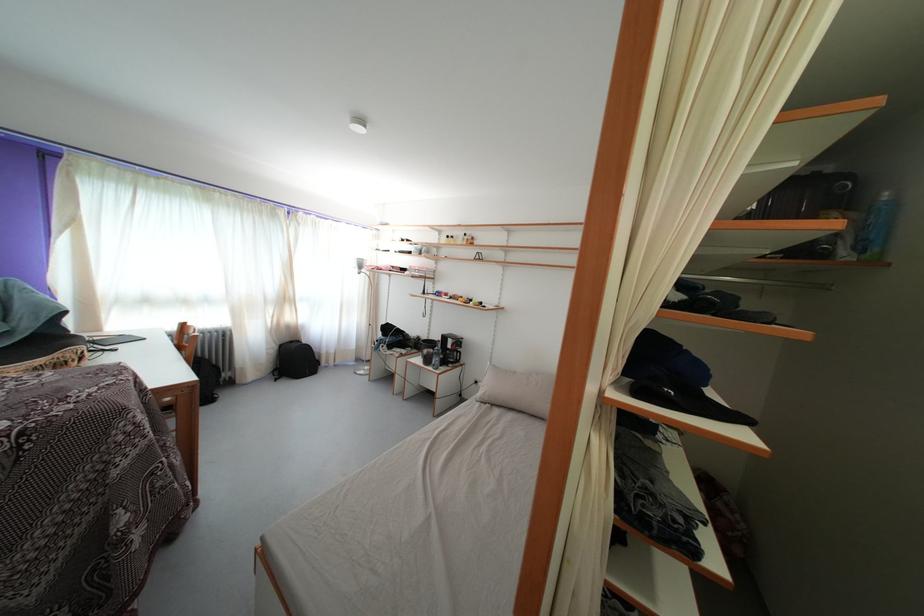
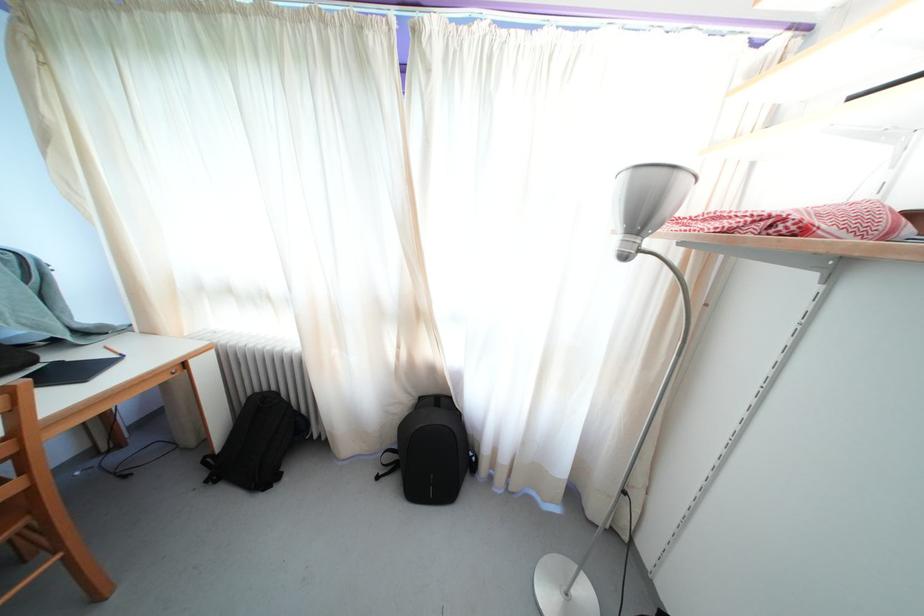
In the second image, find the point that corresponds to (292,305) in the first image.

(421, 321)